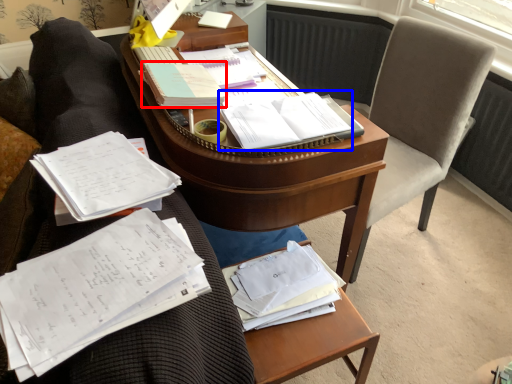
Question: Among these objects, which one is nearest to the camera, book (highlighted by a red box) or book (highlighted by a blue box)?

Choices:
 (A) book
 (B) book

Answer: (B)